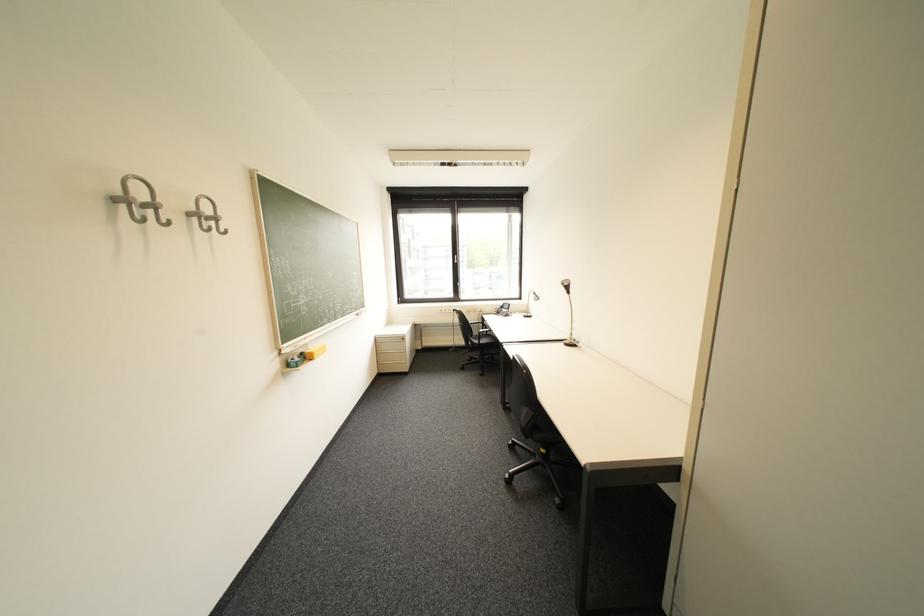
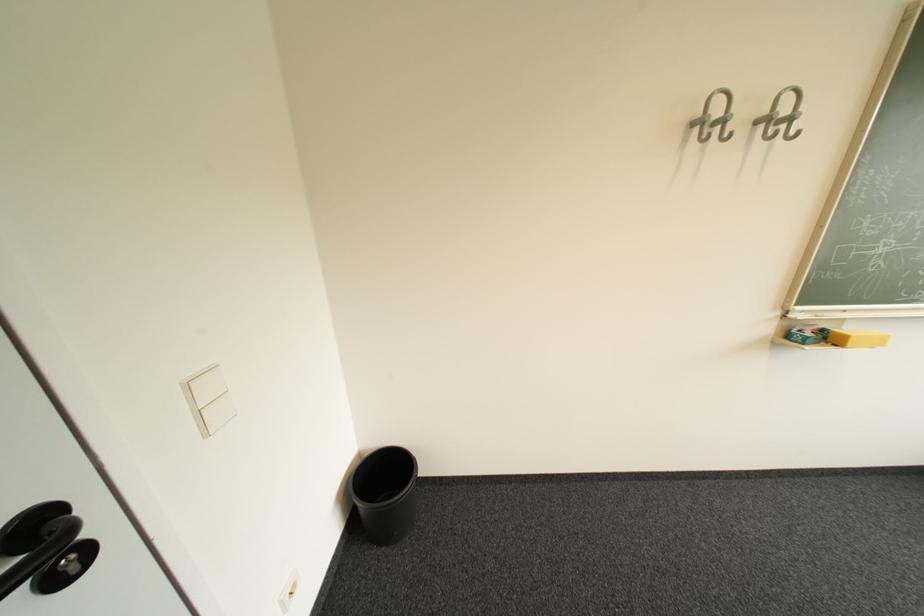
Locate, in the second image, the point that corresponds to point (322, 361) in the first image.

(846, 346)